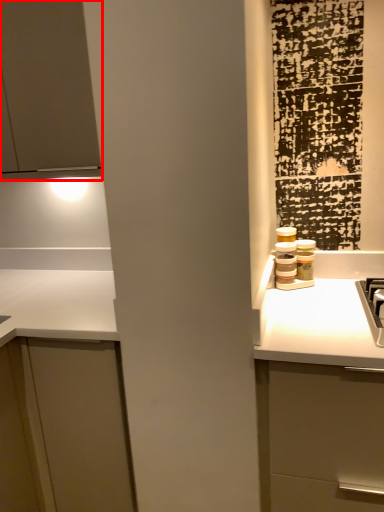
Question: In this image, where is cabinetry (annotated by the red box) located relative to cabinetry?

Choices:
 (A) left
 (B) right

Answer: (A)